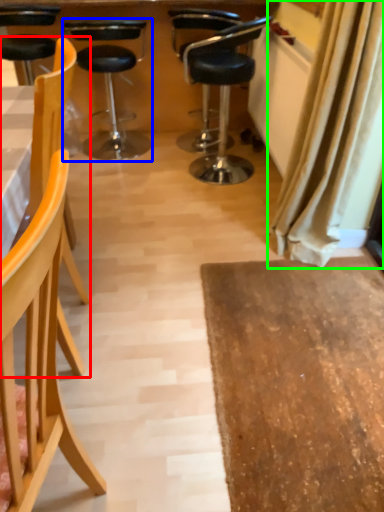
Question: Considering the real-world distances, which object is farthest from chair (highlighted by a red box)? chair (highlighted by a blue box) or curtain (highlighted by a green box)?

Choices:
 (A) chair
 (B) curtain

Answer: (A)